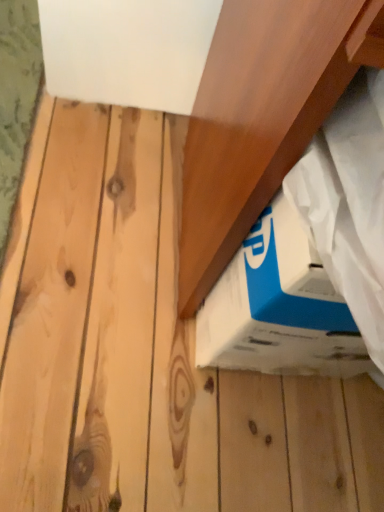
I want to click on wooden at upper right, so click(x=261, y=117).

The image size is (384, 512). Describe the element at coordinates (261, 117) in the screenshot. I see `wooden at upper right` at that location.

The height and width of the screenshot is (512, 384). I want to click on blue cardboard box at lower right, so click(278, 307).

Image resolution: width=384 pixels, height=512 pixels. What do you see at coordinates (278, 307) in the screenshot? I see `blue cardboard box at lower right` at bounding box center [278, 307].

Measure the distance between blue cardboard box at lower right and camera.

A distance of 13.78 inches exists between blue cardboard box at lower right and camera.

Where is `wooden at upper right`? wooden at upper right is located at coordinates (261, 117).

Based on their positions, is blue cardboard box at lower right located to the left or right of wooden at upper right?

Clearly, blue cardboard box at lower right is on the left of wooden at upper right in the image.

Relative to wooden at upper right, is blue cardboard box at lower right in front or behind?

blue cardboard box at lower right is positioned farther from the viewer than wooden at upper right.

Does point (297, 307) lie in front of point (340, 55)?

No, (297, 307) is behind (340, 55).

From the image's perspective, would you say blue cardboard box at lower right is shown under wooden at upper right?

Indeed, from the image's perspective, blue cardboard box at lower right is shown beneath wooden at upper right.

From a real-world perspective, is blue cardboard box at lower right physically located above or below wooden at upper right?

From a real-world perspective, blue cardboard box at lower right is physically below wooden at upper right.

Considering the sizes of blue cardboard box at lower right and wooden at upper right in the image, is blue cardboard box at lower right wider or thinner than wooden at upper right?

Clearly, blue cardboard box at lower right has less width compared to wooden at upper right.

Does blue cardboard box at lower right have a greater height compared to wooden at upper right?

No, blue cardboard box at lower right is not taller than wooden at upper right.

Who is bigger, blue cardboard box at lower right or wooden at upper right?

wooden at upper right is bigger.

Would you say blue cardboard box at lower right contains wooden at upper right?

No, wooden at upper right is located outside of blue cardboard box at lower right.

Does blue cardboard box at lower right touch wooden at upper right?

No, blue cardboard box at lower right is not with wooden at upper right.

Is blue cardboard box at lower right aimed at wooden at upper right?

Yes, blue cardboard box at lower right is turned towards wooden at upper right.

Identify the location of plank that appears on the right of blue cardboard box at lower right. (261, 117).

Visually, is wooden at upper right positioned to the left or to the right of blue cardboard box at lower right?

From the image, it's evident that wooden at upper right is to the right of blue cardboard box at lower right.

Relative to blue cardboard box at lower right, is wooden at upper right in front or behind?

wooden at upper right is in front of blue cardboard box at lower right.

Between point (204, 146) and point (284, 297), which one is positioned in front?

Point (284, 297)

Looking at this image, from the image's perspective, relative to blue cardboard box at lower right, is wooden at upper right above or below?

wooden at upper right is above blue cardboard box at lower right.

From a real-world perspective, who is located higher, wooden at upper right or blue cardboard box at lower right?

wooden at upper right, from a real-world perspective.

In the scene shown: Between wooden at upper right and blue cardboard box at lower right, which one has smaller width?

Thinner between the two is blue cardboard box at lower right.

Considering the relative sizes of wooden at upper right and blue cardboard box at lower right in the image provided, is wooden at upper right taller than blue cardboard box at lower right?

Indeed, wooden at upper right has a greater height compared to blue cardboard box at lower right.

Considering the relative sizes of wooden at upper right and blue cardboard box at lower right in the image provided, is wooden at upper right smaller than blue cardboard box at lower right?

No, wooden at upper right is not smaller than blue cardboard box at lower right.

Would you say wooden at upper right is outside blue cardboard box at lower right?

Yes, wooden at upper right is outside of blue cardboard box at lower right.

Is there a large distance between wooden at upper right and blue cardboard box at lower right?

They are positioned close to each other.

Is wooden at upper right facing away from blue cardboard box at lower right?

No, wooden at upper right's orientation is not away from blue cardboard box at lower right.

How distant is wooden at upper right from blue cardboard box at lower right?

The distance of wooden at upper right from blue cardboard box at lower right is 4.71 inches.

Locate an element on the screen. The image size is (384, 512). box below the wooden at upper right (from the image's perspective) is located at coordinates (278, 307).

Where is `plank in front of the blue cardboard box at lower right`? The height and width of the screenshot is (512, 384). plank in front of the blue cardboard box at lower right is located at coordinates (261, 117).

I want to click on plank above the blue cardboard box at lower right (from a real-world perspective), so click(261, 117).